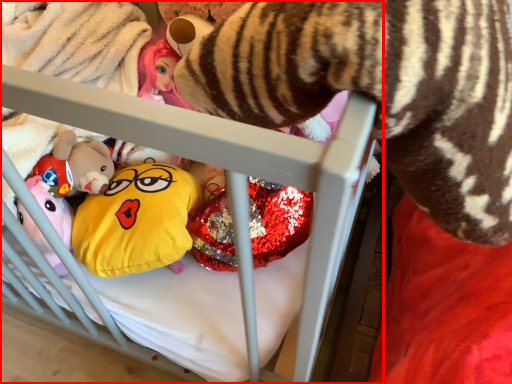
Question: Considering the relative positions of infant bed (annotated by the red box) and toy in the image provided, where is infant bed (annotated by the red box) located with respect to the staircase?

Choices:
 (A) right
 (B) left

Answer: (B)